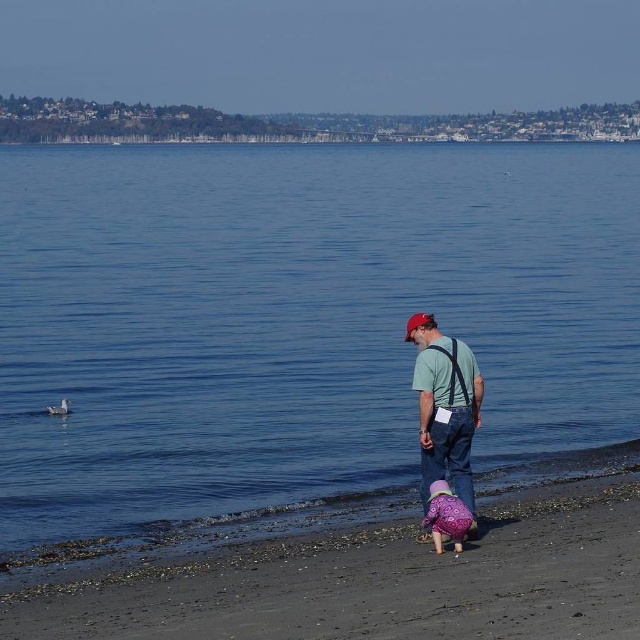
Between point (333, 584) and point (451, 515), which one is positioned in front?

Point (333, 584) is more forward.

Who is taller, dark brown sandy beach at lower center or purple fuzzy coat at lower center?

purple fuzzy coat at lower center

Is point (515, 506) positioned behind point (449, 499)?

That is True.

I want to click on dark brown sandy beach at lower center, so click(x=371, y=580).

Who is higher up, blue water at center or matte green shirt at center?

blue water at center

Consider the image. Can you confirm if blue water at center is thinner than matte green shirt at center?

Incorrect, blue water at center's width is not less than matte green shirt at center's.

Find the location of a particular element. blue water at center is located at coordinates (300, 324).

Image resolution: width=640 pixels, height=640 pixels. Describe the element at coordinates (300, 324) in the screenshot. I see `blue water at center` at that location.

Between blue water at center and dark brown sandy beach at lower center, which one has less height?

With less height is dark brown sandy beach at lower center.

This screenshot has width=640, height=640. Describe the element at coordinates (300, 324) in the screenshot. I see `blue water at center` at that location.

The height and width of the screenshot is (640, 640). I want to click on blue water at center, so click(x=300, y=324).